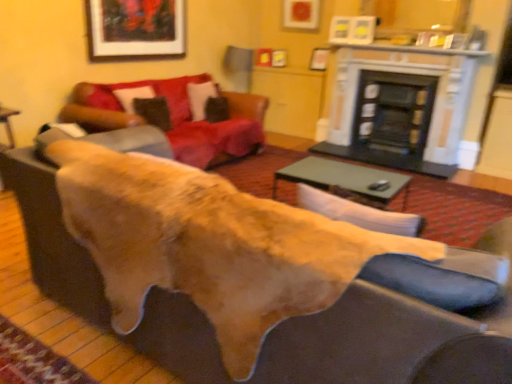
Question: Considering the relative sizes of brown suede pillow at upper left, the 2th pillow from the right, and black glass fireplace at center, which appears as the second fireplace when viewed from the left, in the image provided, is brown suede pillow at upper left, the 2th pillow from the right, smaller than black glass fireplace at center, which appears as the second fireplace when viewed from the left,?

Choices:
 (A) no
 (B) yes

Answer: (B)

Question: Is brown suede pillow at upper left, the 2th pillow positioned from the back, oriented towards black glass fireplace at center, which appears as the second fireplace when viewed from the left?

Choices:
 (A) yes
 (B) no

Answer: (B)

Question: Is brown suede pillow at upper left, which is the 1th pillow from front to back, to the left of black glass fireplace at center, which appears as the second fireplace when viewed from the left, from the viewer's perspective?

Choices:
 (A) no
 (B) yes

Answer: (B)

Question: Does brown suede pillow at upper left, positioned as the first pillow in left-to-right order, have a greater height compared to black glass fireplace at center, which appears as the second fireplace when viewed from the left?

Choices:
 (A) yes
 (B) no

Answer: (B)

Question: From a real-world perspective, is brown suede pillow at upper left, the 2th pillow from the right, below black glass fireplace at center, the 1th fireplace positioned from the right?

Choices:
 (A) no
 (B) yes

Answer: (A)

Question: From the image's perspective, does leather couch at center appear higher than brown suede pillow at upper left, the 2th pillow from the right?

Choices:
 (A) no
 (B) yes

Answer: (A)

Question: Is leather couch at center taller than brown suede pillow at upper left, the 2th pillow from the right?

Choices:
 (A) no
 (B) yes

Answer: (B)

Question: Does leather couch at center appear on the left side of brown suede pillow at upper left, the 2th pillow positioned from the back?

Choices:
 (A) yes
 (B) no

Answer: (B)

Question: Is leather couch at center looking in the opposite direction of brown suede pillow at upper left, the 2th pillow from the right?

Choices:
 (A) no
 (B) yes

Answer: (A)

Question: Considering the relative positions of leather couch at center and brown suede pillow at upper left, the 2th pillow positioned from the back, in the image provided, is leather couch at center behind brown suede pillow at upper left, the 2th pillow positioned from the back,?

Choices:
 (A) yes
 (B) no

Answer: (B)

Question: Is leather couch at center surrounding brown suede pillow at upper left, the 2th pillow positioned from the back?

Choices:
 (A) yes
 (B) no

Answer: (B)

Question: From a real-world perspective, is black glass fireplace at center, the 1th fireplace positioned from the right, below velvet red couch at upper center?

Choices:
 (A) yes
 (B) no

Answer: (A)